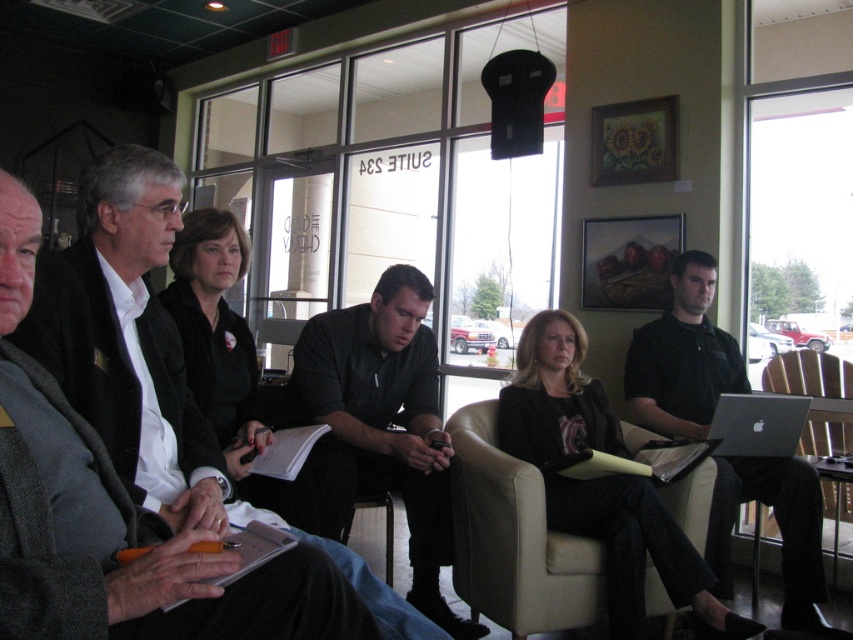
You are an office worker who needs to sit in the beige leather armchair at center for a meeting. Can you reach the windowsill outside Suite 234 from your seat?

The beige leather armchair at center is located at point (514, 538), which is near the center of the room. Since the windows display the exterior of Suite 234, the windowsill is part of the same window, so you can reach it from the armchair.